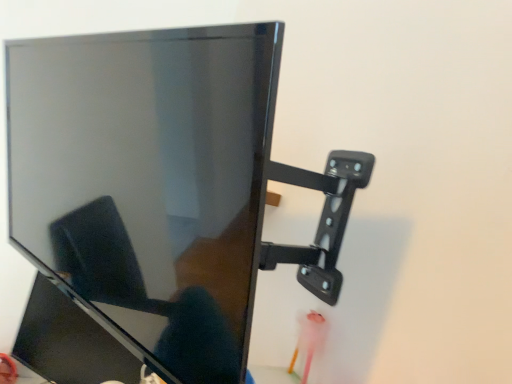
Locate an element on the screen. The image size is (512, 384). glossy black monitor at center is located at coordinates (69, 342).

Describe the element at coordinates (69, 342) in the screenshot. I see `glossy black monitor at center` at that location.

I want to click on glossy black monitor at center, so click(69, 342).